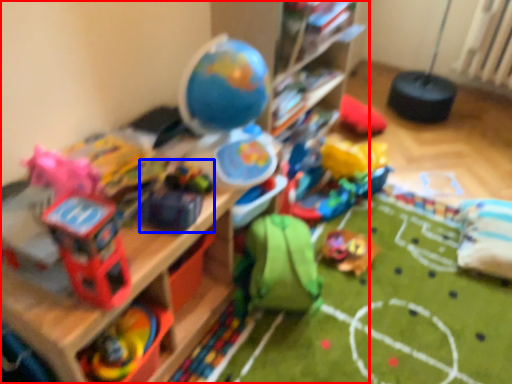
Question: Which object appears farthest to the camera in this image, shelf (highlighted by a red box) or toy (highlighted by a blue box)?

Choices:
 (A) shelf
 (B) toy

Answer: (B)